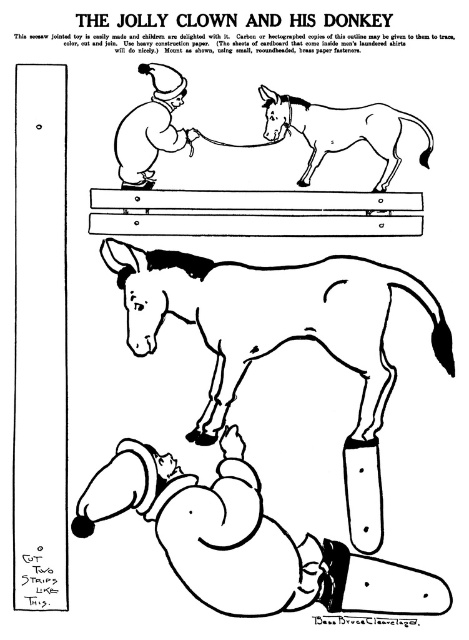
Consider the image. You are assembling the toy seesaw from the instructions. You have the white paper horse at lower center and the brown paper donkey at upper center. Which animal should you place on the lower end of the seesaw to balance it?

The white paper horse at lower center should be placed on the lower end of the seesaw because it is already positioned below the brown paper donkey at upper center in the instructions, indicating their correct placement for balance.

You are trying to assemble the toy seesaw from the instructions. The smooth wood plank at center is the base for the brown paper donkey at upper center. Since the plank is shorter, will the donkey fit entirely on the plank?

The smooth wood plank at center is shorter than the brown paper donkey at upper center, so the donkey will not fit entirely on the plank.